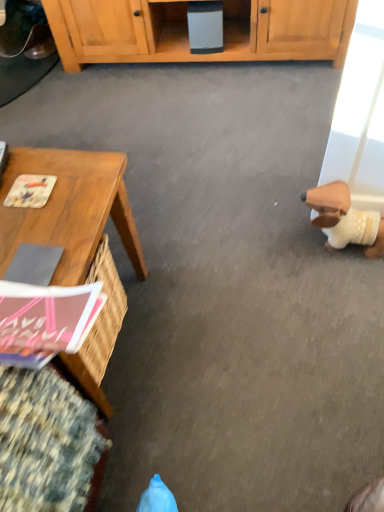
The width and height of the screenshot is (384, 512). What are the coordinates of `free space to the left of brown plush toy at right` in the screenshot? It's located at (286, 249).